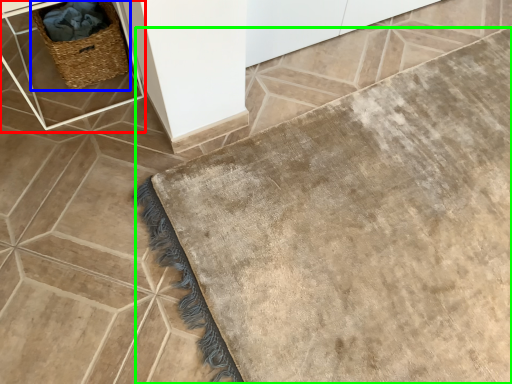
Question: Considering the real-world distances, which object is closest to table (highlighted by a red box)? picnic basket (highlighted by a blue box) or bath mat (highlighted by a green box).

Choices:
 (A) picnic basket
 (B) bath mat

Answer: (A)